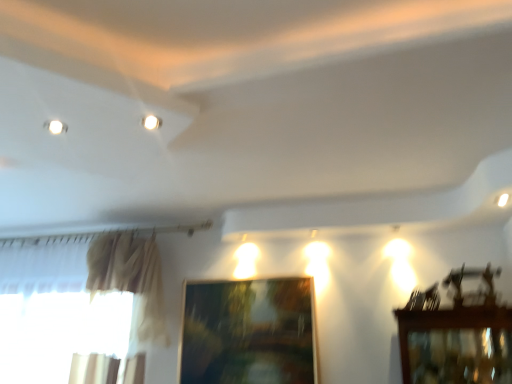
Question: Is white glossy light at upper right bigger or smaller than white glossy light fixture at upper center?

Choices:
 (A) small
 (B) big

Answer: (B)

Question: From a real-world perspective, is white glossy light at upper right physically located above or below white glossy light fixture at upper center?

Choices:
 (A) above
 (B) below

Answer: (B)

Question: Estimate the real-world distances between objects in this image. Which object is farther from the white glossy light fixture at upper center?

Choices:
 (A) white glossy light at upper right
 (B) wooden picture frame at center

Answer: (B)

Question: Which object is positioned farthest from the white glossy light at upper right?

Choices:
 (A) wooden picture frame at center
 (B) white glossy light fixture at upper center

Answer: (A)